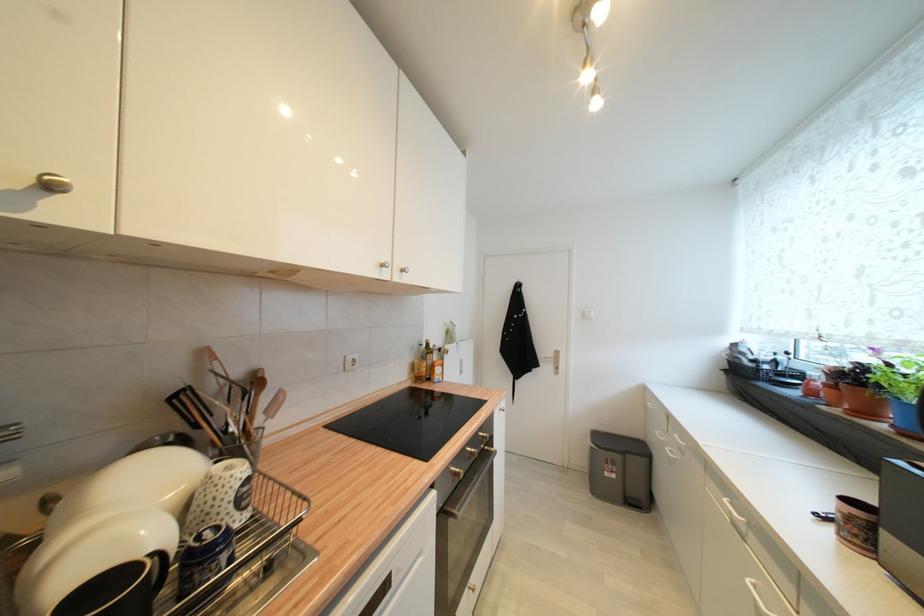
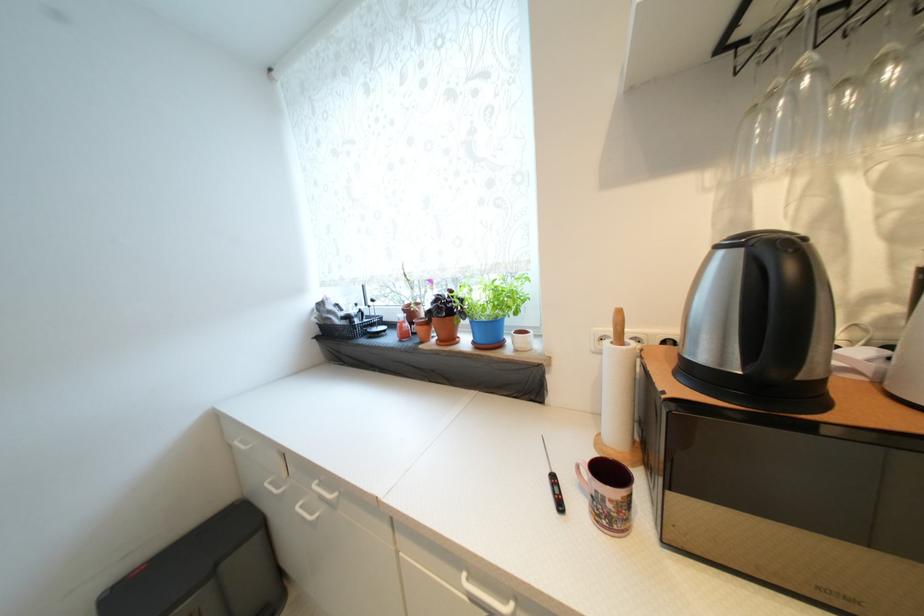
In the second image, find the point that corresponds to the point at 650,462 in the first image.

(261, 541)